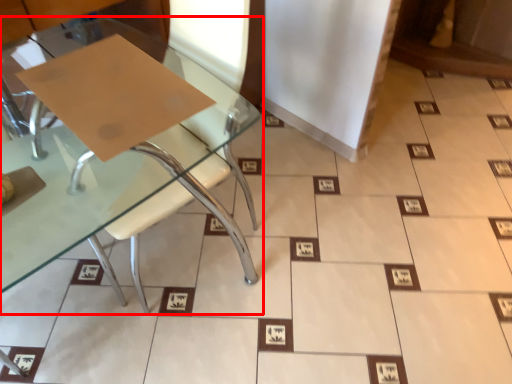
Question: From the image's perspective, where is table (annotated by the red box) located relative to cardboard?

Choices:
 (A) below
 (B) above

Answer: (A)